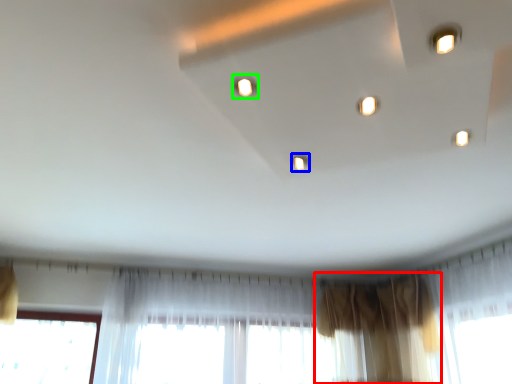
Question: Which object is positioned farthest from curtain (highlighted by a red box)? Select from light (highlighted by a blue box) and light (highlighted by a green box).

Choices:
 (A) light
 (B) light

Answer: (B)